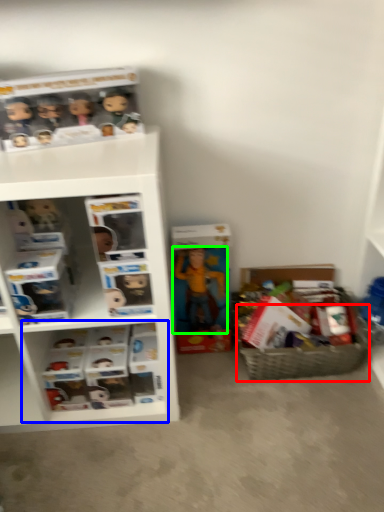
Question: Considering the real-world distances, which object is closest to basket (highlighted by a red box)? cabinet (highlighted by a blue box) or toy (highlighted by a green box).

Choices:
 (A) cabinet
 (B) toy

Answer: (B)